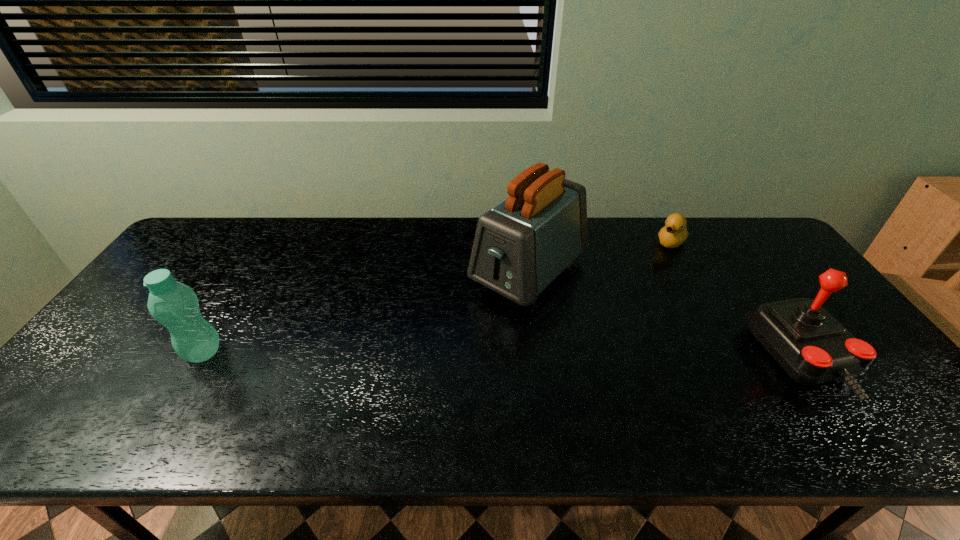
Where is `vacant space on the desktop that is between the leftmost object and the rightmost object and is positioned facing forward on the shortest object`? The image size is (960, 540). vacant space on the desktop that is between the leftmost object and the rightmost object and is positioned facing forward on the shortest object is located at coordinates (576, 356).

This screenshot has height=540, width=960. I want to click on free space on the desktop that is between the bottle and the joystick and is positioned on the front-facing side of the toaster, so click(x=437, y=355).